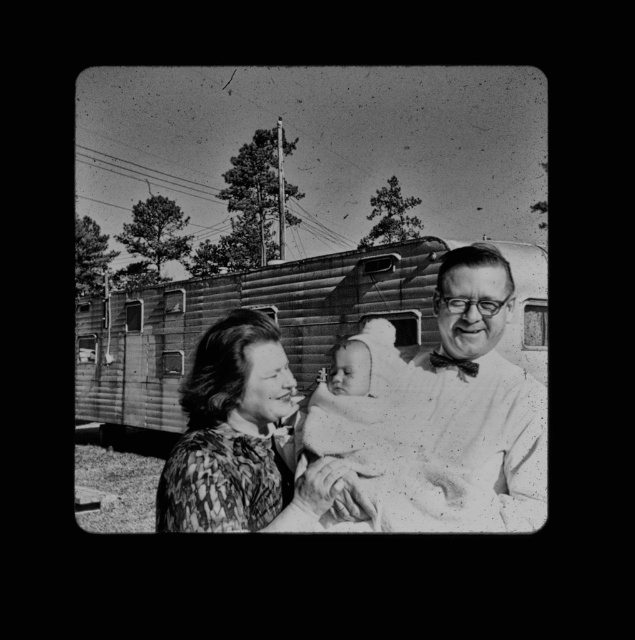
You are a photographer analyzing this vintage image. You notice the smooth white shirt at center and the patterned fabric woman at center. Which object occupies a larger area in the photo?

The smooth white shirt at center is bigger than the patterned fabric woman at center, so it occupies a larger area in the photo.

You are looking at the vintage photograph and notice two points marked in the image. The first point is at coordinates point (408, 486) and the second is at point (163, 481). Which of these two points is closer to the camera?

Point (408, 486) is closer to the camera than point (163, 481).

You are an observer looking at this vintage photograph. You notice the smooth white shirt at center and the patterned fabric woman at center. Which object appears taller in the image?

The smooth white shirt at center appears taller than the patterned fabric woman at center in the image.